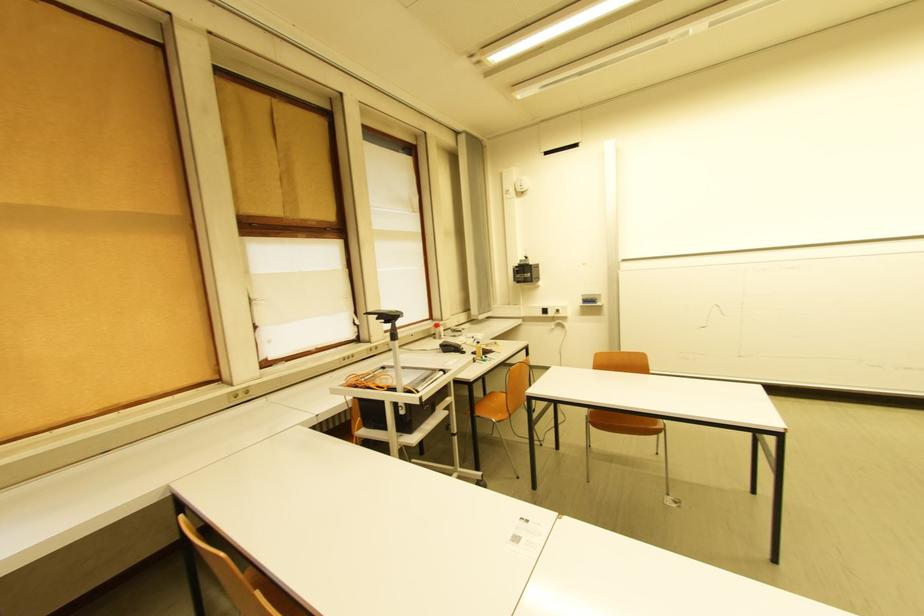
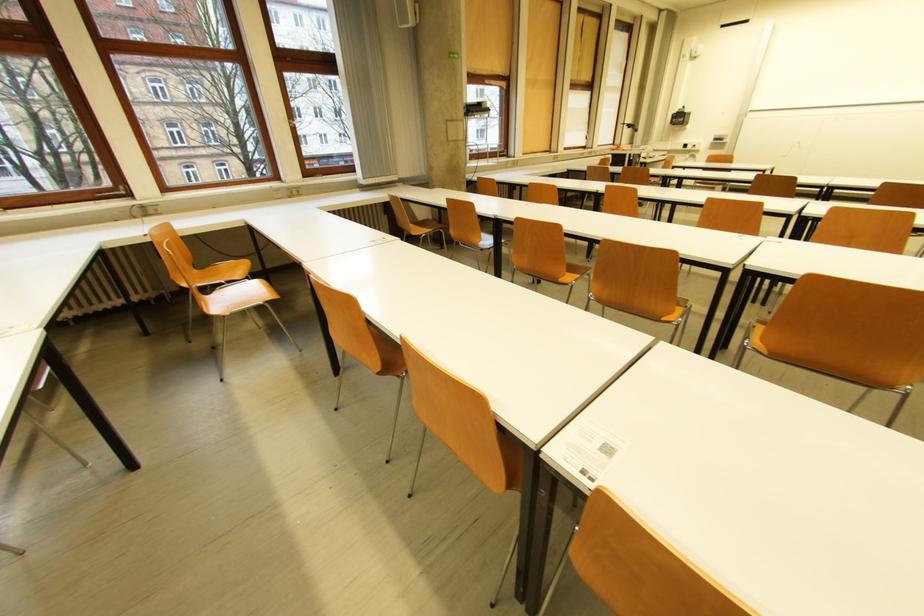
Find the pixel in the second image that matches [552,312] in the first image.

(691, 147)